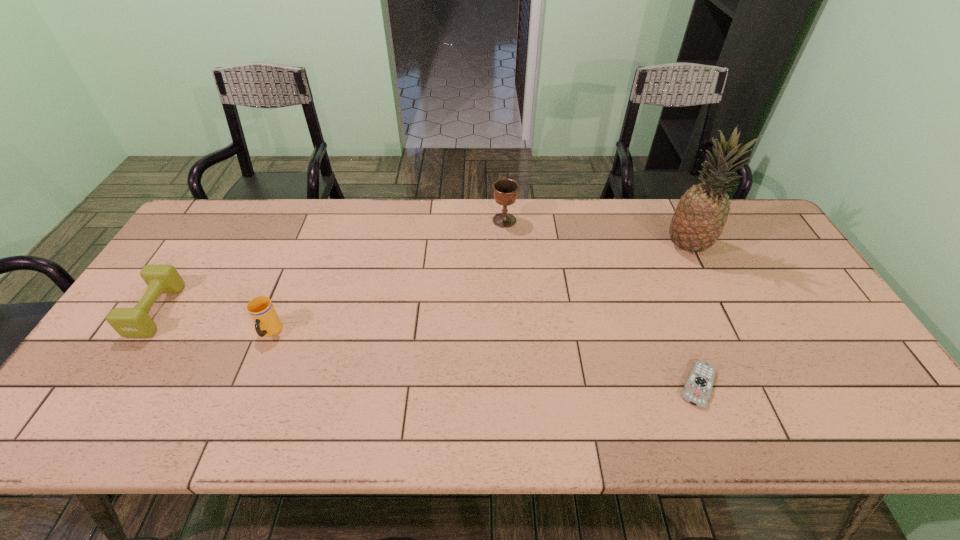
The height and width of the screenshot is (540, 960). I want to click on vacant space at the right edge of the desktop, so click(816, 304).

You are a GUI agent. You are given a task and a screenshot of the screen. Output one action in this format:
    pyautogui.click(x=<x>, y=<y>)
    Task: Click on the free spot at the far left corner of the desktop
    
    Given the screenshot: What is the action you would take?
    pyautogui.click(x=249, y=220)

This screenshot has height=540, width=960. In the image, there is a desktop. In order to click on free space at the far right corner in this screenshot , I will do `click(767, 231)`.

This screenshot has width=960, height=540. What are the coordinates of `free space between the second farthest object and the chalice` in the screenshot? It's located at (595, 233).

The height and width of the screenshot is (540, 960). I want to click on vacant space that is in between the fourth nearest object and the farthest object, so click(595, 233).

Locate an element on the screen. empty location between the second shortest object and the fourth shortest object is located at coordinates (330, 265).

I want to click on free space between the tallest object and the second shortest object, so [421, 278].

Find the location of a particular element. This screenshot has width=960, height=540. free space between the remote control and the fourth object from right to left is located at coordinates (484, 359).

Locate an element on the screen. The height and width of the screenshot is (540, 960). free spot between the second object from right to left and the fourth nearest object is located at coordinates (692, 316).

Locate an element on the screen. vacant area that lies between the third object from left to right and the cup is located at coordinates (387, 276).